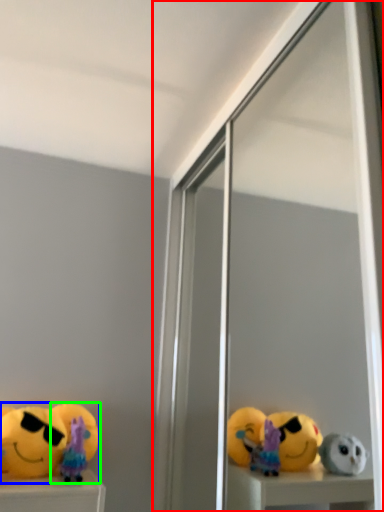
Question: Which object is positioned farthest from screen door (highlighted by a red box)? Select from toy (highlighted by a blue box) and toy (highlighted by a green box).

Choices:
 (A) toy
 (B) toy

Answer: (B)